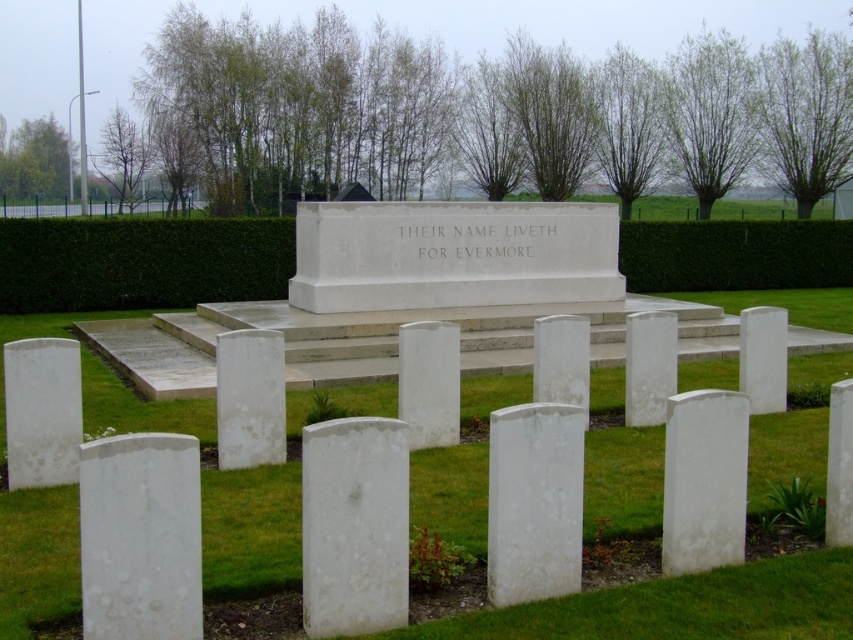
Question: Can you confirm if green grass at center is thinner than green leafy hedge at center?

Choices:
 (A) no
 (B) yes

Answer: (A)

Question: Estimate the real-world distances between objects in this image. Which object is closer to the green hedge at upper center?

Choices:
 (A) green grass at center
 (B) green leafy hedge at center

Answer: (B)

Question: Which point is closer to the camera taking this photo?

Choices:
 (A) (277, 564)
 (B) (51, 289)

Answer: (A)

Question: Does green leafy hedge at center have a greater width compared to green hedge at upper center?

Choices:
 (A) yes
 (B) no

Answer: (A)

Question: Which object is farther from the camera taking this photo?

Choices:
 (A) green hedge at upper center
 (B) green leafy hedge at center
 (C) green grass at center

Answer: (A)

Question: Does green leafy hedge at center lie in front of green hedge at upper center?

Choices:
 (A) yes
 (B) no

Answer: (A)